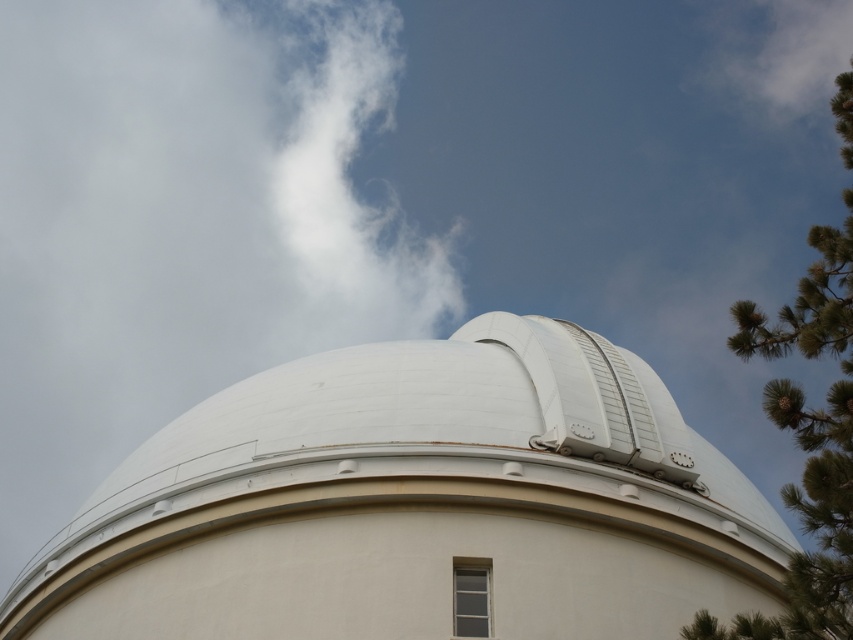
Question: Does white smooth dome at center appear under white fluffy cloud at upper left?

Choices:
 (A) yes
 (B) no

Answer: (A)

Question: Can you confirm if white smooth dome at center is positioned above white fluffy cloud at upper left?

Choices:
 (A) yes
 (B) no

Answer: (B)

Question: Can you confirm if white smooth dome at center is thinner than white fluffy cloud at upper left?

Choices:
 (A) yes
 (B) no

Answer: (B)

Question: Among these objects, which one is nearest to the camera?

Choices:
 (A) white smooth dome at center
 (B) white fluffy cloud at upper left

Answer: (A)